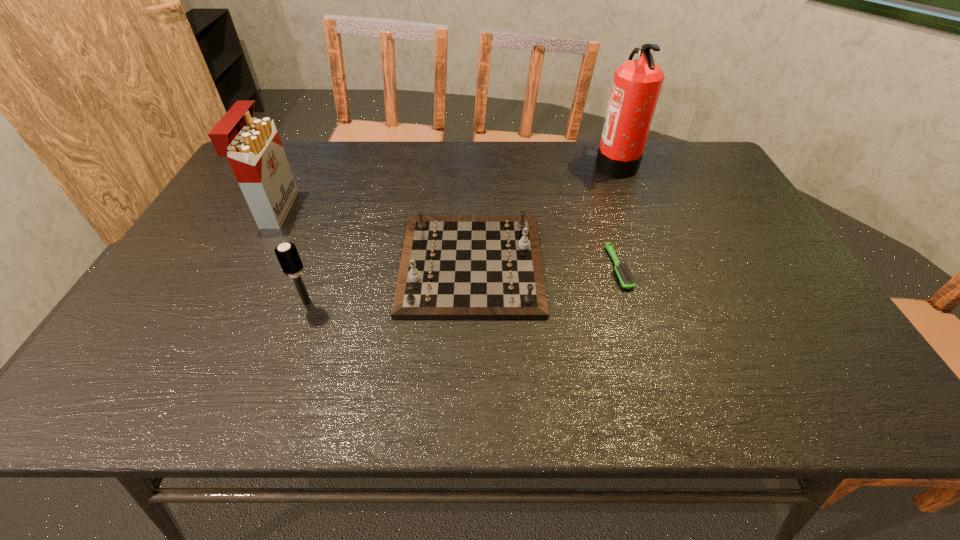
Identify the location of vacant space at the right edge. The image size is (960, 540). pyautogui.click(x=711, y=192).

Locate an element on the screen. vacant point at the near left corner is located at coordinates (129, 406).

The height and width of the screenshot is (540, 960). In the image, there is a desktop. Find the location of `vacant space at the far right corner`. vacant space at the far right corner is located at coordinates (698, 176).

Locate an element on the screen. This screenshot has width=960, height=540. free region at the near right corner of the desktop is located at coordinates (786, 387).

Find the location of a particular element. Image resolution: width=960 pixels, height=540 pixels. empty location between the third object from left to right and the tallest object is located at coordinates (543, 214).

The width and height of the screenshot is (960, 540). Identify the location of free space between the chessboard and the farther hairbrush. (545, 266).

Identify the location of vacant point located between the farther hairbrush and the third object from right to left. (545, 266).

Where is `vacant space that's between the farthest object and the cigarette case`? vacant space that's between the farthest object and the cigarette case is located at coordinates (445, 187).

What are the coordinates of `vacant space in between the chessboard and the cigarette case` in the screenshot? It's located at (373, 237).

Point out which object is positioned as the fourth nearest to the leftmost object. Please provide its 2D coordinates. Your answer should be formatted as a tuple, i.e. [(x, y)], where the tuple contains the x and y coordinates of a point satisfying the conditions above.

[(637, 83)]